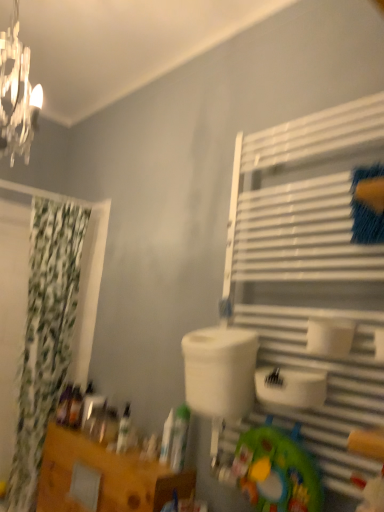
The width and height of the screenshot is (384, 512). I want to click on vacant position to the left of white matte tube at center, marked as the 5th toiletry in a back-to-front arrangement, so click(x=152, y=464).